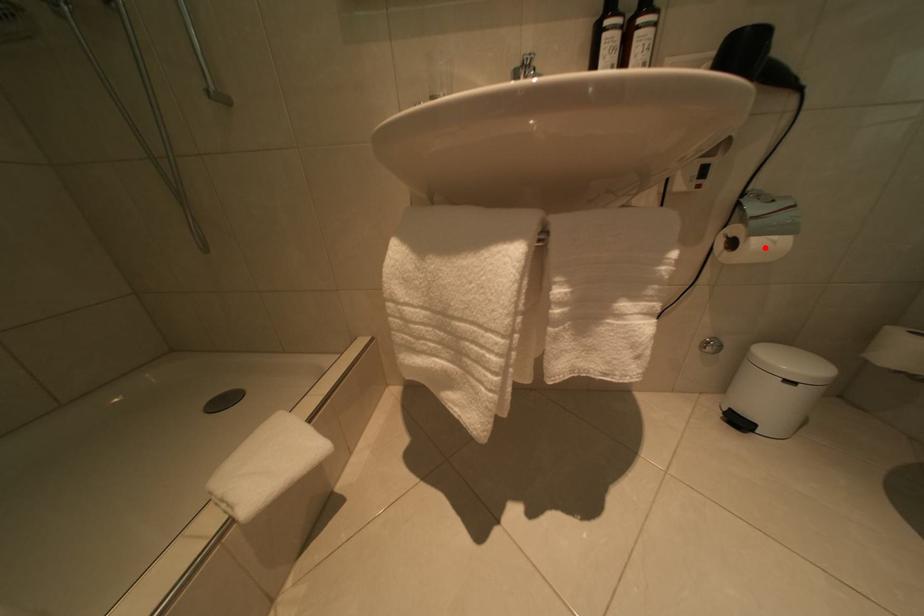
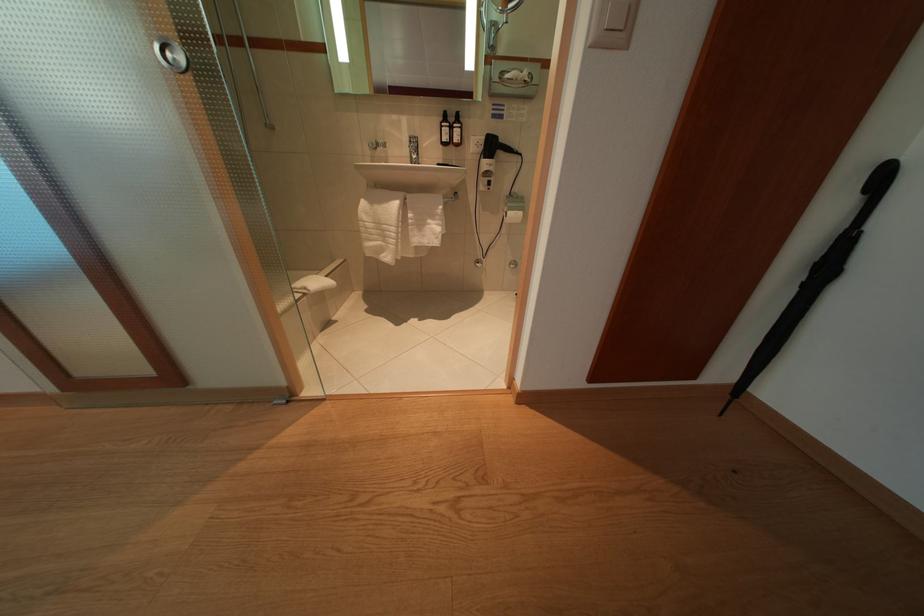
The point at the highlighted location is marked in the first image. Where is the corresponding point in the second image?

(517, 219)